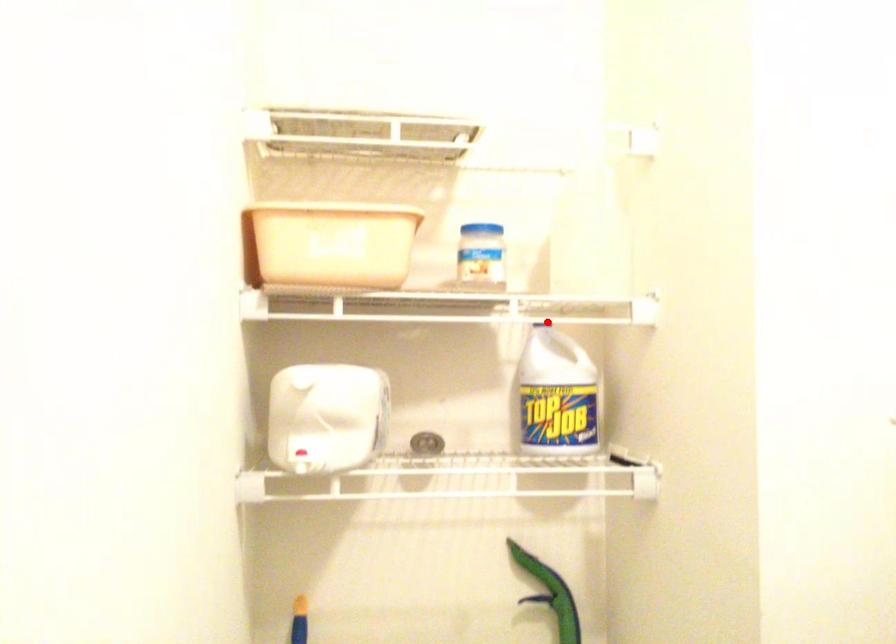
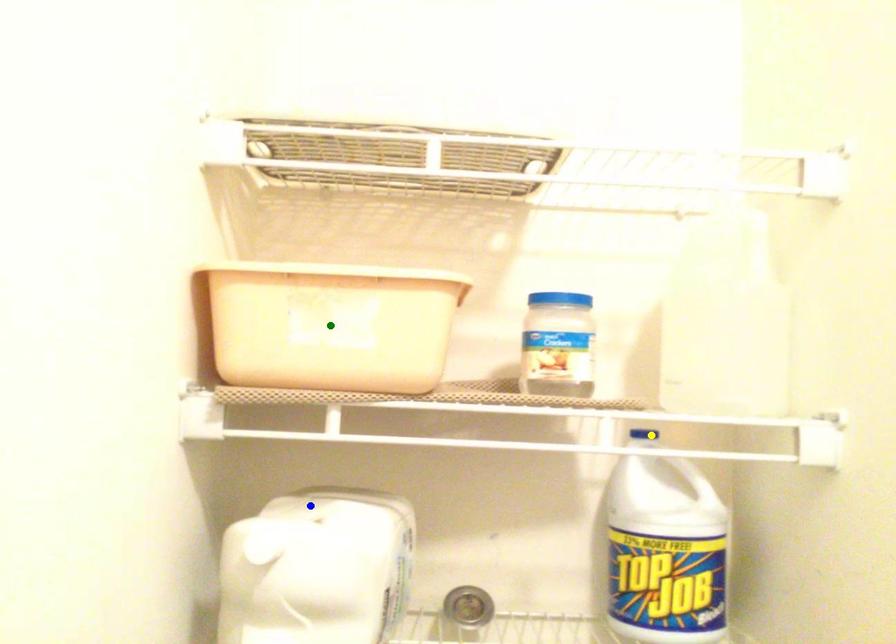
Question: I am providing you with two images of the same scene from different viewpoints. A red point is marked on the first image. You are given multiple points on the second image. Which mark in image 2 goes with the point in image 1?

Choices:
 (A) green point
 (B) blue point
 (C) yellow point

Answer: (C)